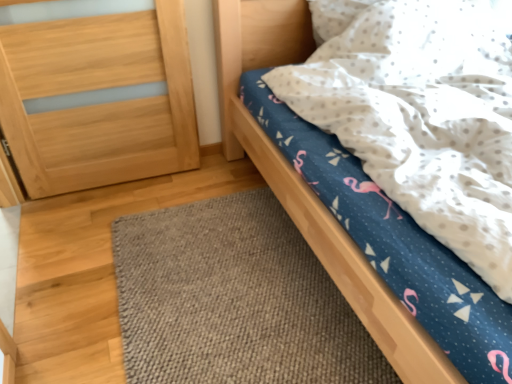
Question: Is brown woven mat at lower center further to camera compared to blue fabric bed at upper right?

Choices:
 (A) no
 (B) yes

Answer: (B)

Question: Is brown woven mat at lower center smaller than blue fabric bed at upper right?

Choices:
 (A) yes
 (B) no

Answer: (A)

Question: From the image's perspective, would you say brown woven mat at lower center is shown under blue fabric bed at upper right?

Choices:
 (A) no
 (B) yes

Answer: (B)

Question: Can we say brown woven mat at lower center lies outside blue fabric bed at upper right?

Choices:
 (A) yes
 (B) no

Answer: (A)

Question: Considering the relative positions of brown woven mat at lower center and blue fabric bed at upper right in the image provided, is brown woven mat at lower center in front of blue fabric bed at upper right?

Choices:
 (A) no
 (B) yes

Answer: (A)

Question: Is point (189, 241) closer or farther from the camera than point (57, 135)?

Choices:
 (A) closer
 (B) farther

Answer: (A)

Question: From a real-world perspective, is brown woven mat at lower center physically located above or below light brown wood at left?

Choices:
 (A) below
 (B) above

Answer: (A)

Question: From the image's perspective, is brown woven mat at lower center positioned above or below light brown wood at left?

Choices:
 (A) above
 (B) below

Answer: (B)

Question: Considering the relative positions of brown woven mat at lower center and light brown wood at left in the image provided, is brown woven mat at lower center to the left or to the right of light brown wood at left?

Choices:
 (A) left
 (B) right

Answer: (B)

Question: From the image's perspective, relative to blue fabric bed at upper right, is brown woven mat at lower center above or below?

Choices:
 (A) below
 (B) above

Answer: (A)

Question: Visually, is brown woven mat at lower center positioned to the left or to the right of blue fabric bed at upper right?

Choices:
 (A) left
 (B) right

Answer: (A)

Question: Is point (292, 357) positioned closer to the camera than point (221, 57)?

Choices:
 (A) farther
 (B) closer

Answer: (B)

Question: From a real-world perspective, relative to blue fabric bed at upper right, is brown woven mat at lower center vertically above or below?

Choices:
 (A) above
 (B) below

Answer: (B)

Question: Considering their positions, is blue fabric bed at upper right located in front of or behind brown woven mat at lower center?

Choices:
 (A) front
 (B) behind

Answer: (A)

Question: Is point (296, 215) positioned closer to the camera than point (398, 379)?

Choices:
 (A) farther
 (B) closer

Answer: (A)